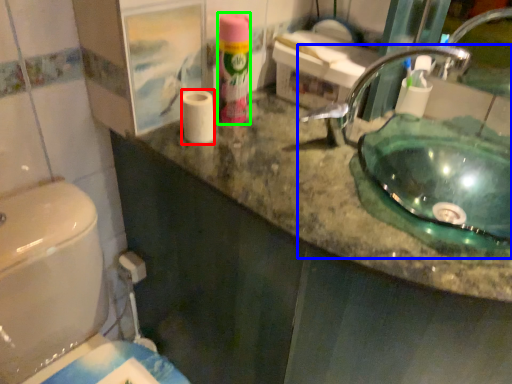
Question: Considering the real-world distances, which object is farthest from toilet paper (highlighted by a red box)? sink (highlighted by a blue box) or cleaning product (highlighted by a green box)?

Choices:
 (A) sink
 (B) cleaning product

Answer: (A)